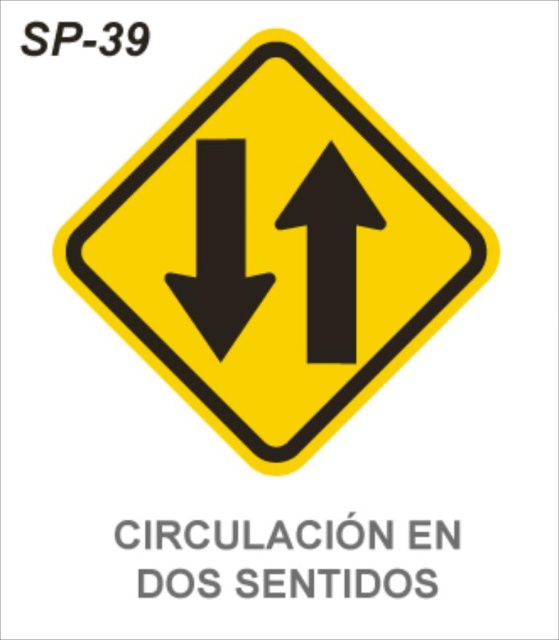
You are a driver approaching a road sign with a black matte arrow at center. Based on the sign, can you determine the direction of the arrow and its meaning?

The black matte arrow at center points downward, indicating that traffic may be coming from behind, while the upward arrow shows traffic moving ahead, meaning the road ahead allows for two way traffic.

You are a driver approaching a road sign with a yellow plastic diamond at center and a black matte arrow at center. The sign has a black border. Which object on the sign is taller?

The yellow plastic diamond at center is taller than the black matte arrow at center according to the description.

You are a driver approaching the road sign and need to determine the distance between two points on the sign to ensure your vehicle can safely navigate around them. The points are point (x=421, y=305) and point (x=244, y=145). Which point is closer to you as you approach the sign?

Point (x=244, y=145) is closer to you than point (x=421, y=305), as it is positioned nearer to the viewer according to the sign.